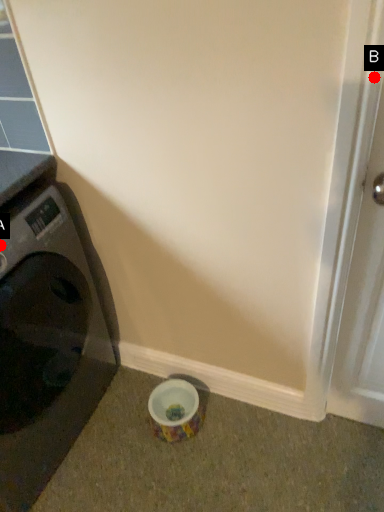
Question: Two points are circled on the image, labeled by A and B beside each circle. Which point is further to the camera?

Choices:
 (A) A is further
 (B) B is further

Answer: (A)